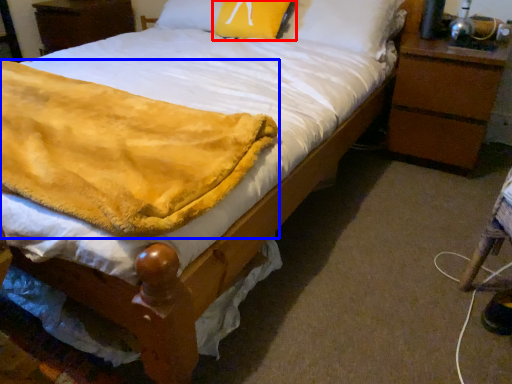
Question: Which object appears farthest to the camera in this image, pillow (highlighted by a red box) or blanket (highlighted by a blue box)?

Choices:
 (A) pillow
 (B) blanket

Answer: (A)